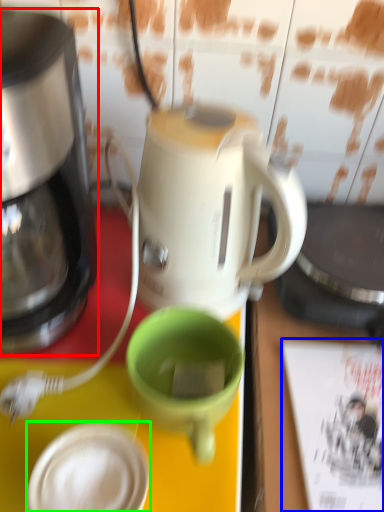
Question: Based on their relative distances, which object is nearer to coffee maker (highlighted by a red box)? Choose from magazine (highlighted by a blue box) and tableware (highlighted by a green box).

Choices:
 (A) magazine
 (B) tableware

Answer: (B)